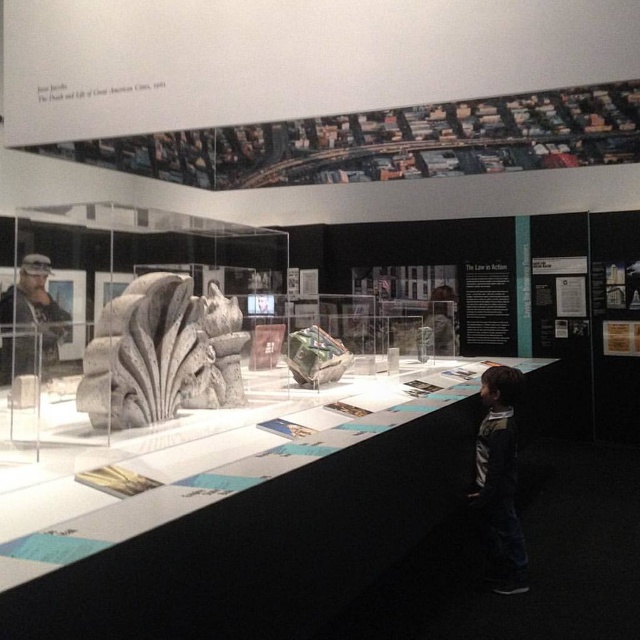
Can you confirm if gray stone sculpture at center is positioned to the left of camouflage fabric uniform at left?

Incorrect, gray stone sculpture at center is not on the left side of camouflage fabric uniform at left.

Who is shorter, gray stone sculpture at center or camouflage fabric uniform at left?

With less height is camouflage fabric uniform at left.

The image size is (640, 640). Describe the element at coordinates (161, 353) in the screenshot. I see `gray stone sculpture at center` at that location.

Identify the location of gray stone sculpture at center. (161, 353).

Is gray stone sculpture at center wider than dark blue jeans at lower right?

Yes, gray stone sculpture at center is wider than dark blue jeans at lower right.

The height and width of the screenshot is (640, 640). What are the coordinates of `gray stone sculpture at center` in the screenshot? It's located at (161, 353).

Does dark blue jeans at lower right have a smaller size compared to camouflage fabric uniform at left?

Yes.

Does dark blue jeans at lower right have a greater width compared to camouflage fabric uniform at left?

No, dark blue jeans at lower right is not wider than camouflage fabric uniform at left.

Identify the location of dark blue jeans at lower right. Image resolution: width=640 pixels, height=640 pixels. (x=499, y=480).